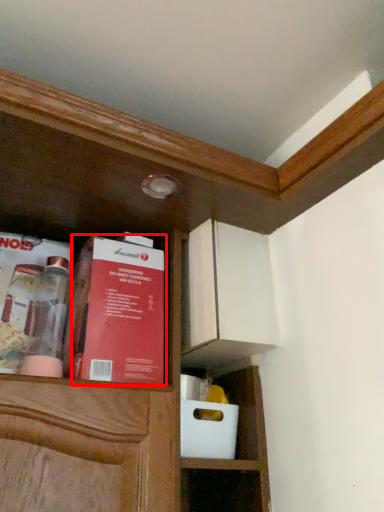
Question: In this image, where is book (annotated by the red box) located relative to book?

Choices:
 (A) right
 (B) left

Answer: (A)